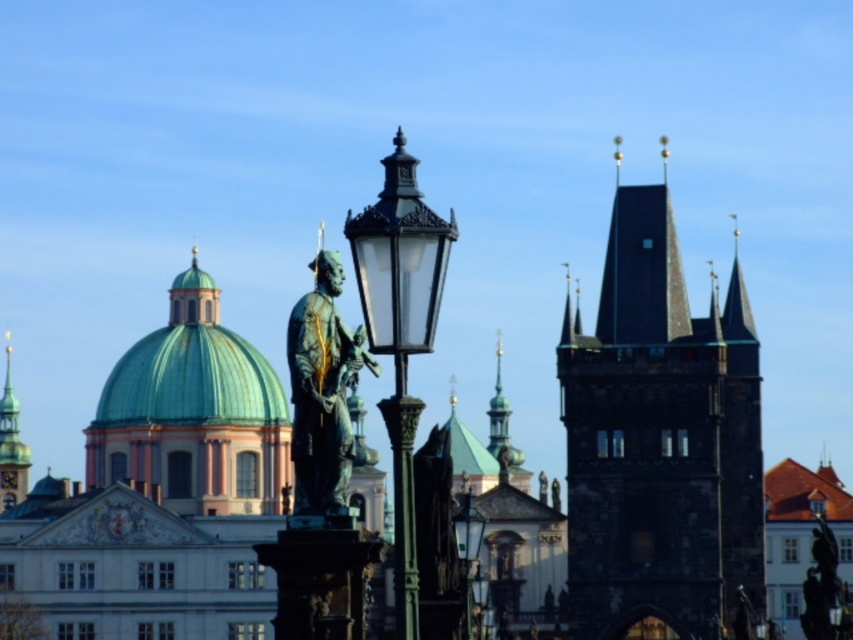
Question: Is polished brass street light at center smaller than matte black street light at center?

Choices:
 (A) no
 (B) yes

Answer: (A)

Question: Is green patinated bronze statue at center bigger than bronze statue at center?

Choices:
 (A) no
 (B) yes

Answer: (B)

Question: Estimate the real-world distances between objects in this image. Which object is closer to the green glass street light at center?

Choices:
 (A) green patinated bronze statue at center
 (B) dark gray stone tower at upper center
 (C) bronze statue at center
 (D) polished brass street light at center

Answer: (C)

Question: Which object is farther from the camera taking this photo?

Choices:
 (A) green copper dome at upper left
 (B) polished brass street light at center

Answer: (A)

Question: Among these objects, which one is nearest to the camera?

Choices:
 (A) green patinated bronze statue at center
 (B) dark gray stone tower at upper center

Answer: (A)

Question: Is bronze statue at center to the left of matte black street light at center from the viewer's perspective?

Choices:
 (A) yes
 (B) no

Answer: (B)